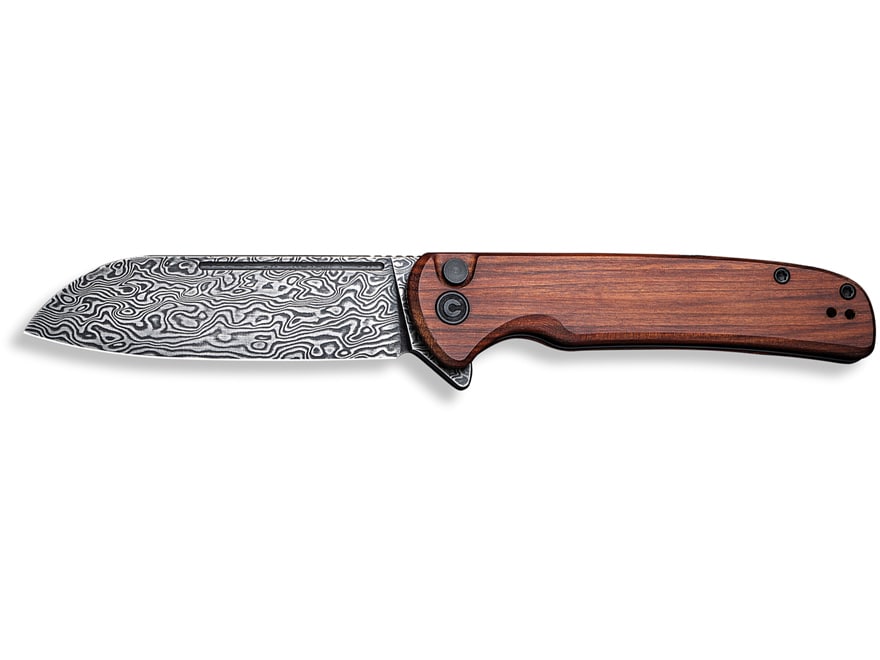
Find the location of `handle`. handle is located at coordinates [x=640, y=314].